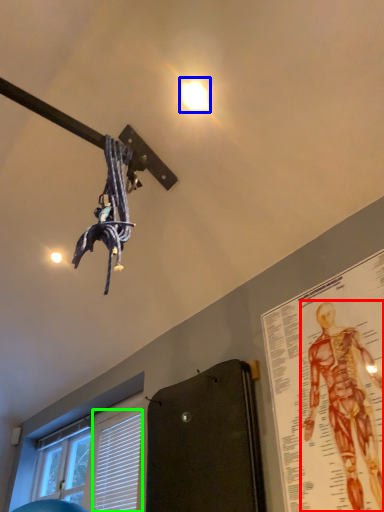
Question: Which object is the closest to the person (highlighted by a red box)? Choose among these: droplight (highlighted by a blue box) or blind (highlighted by a green box).

Choices:
 (A) droplight
 (B) blind

Answer: (A)